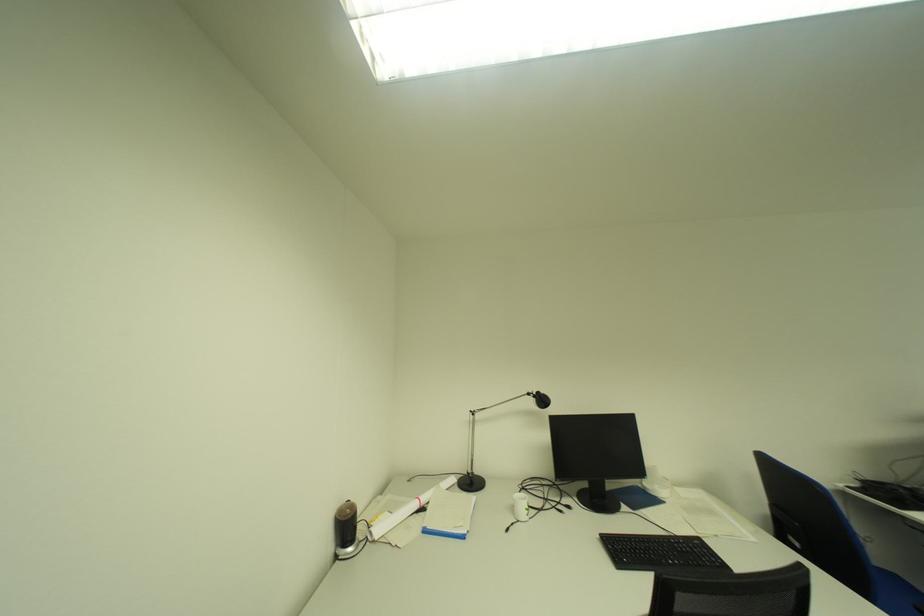
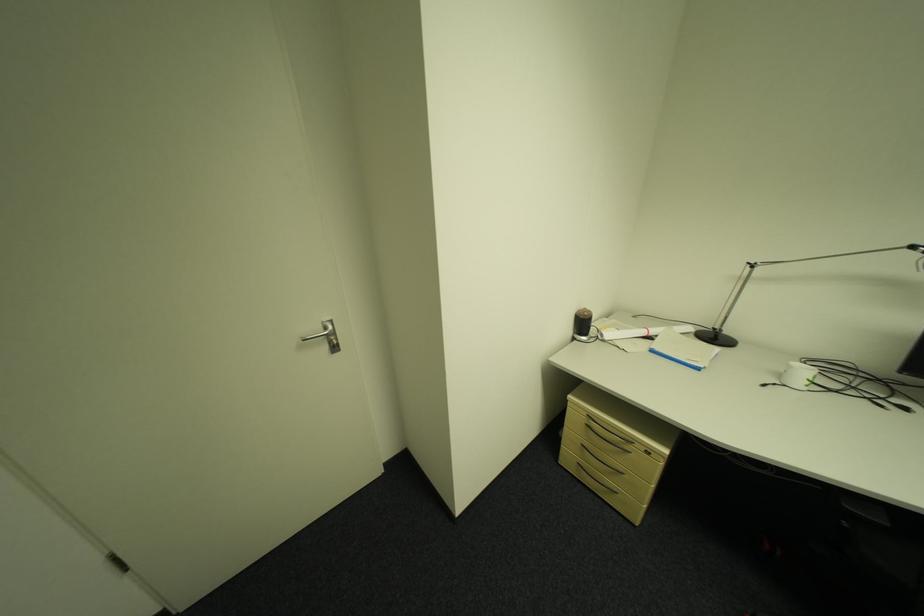
Locate, in the second image, the point that corresponds to point (346, 559) in the first image.

(582, 339)